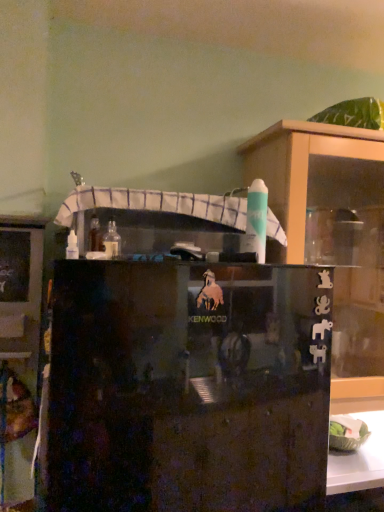
Question: Considering their positions, is black glossy cabinet at center, the 1th cabinetry positioned from the right, located in front of or behind clear glass bottle at center?

Choices:
 (A) front
 (B) behind

Answer: (A)

Question: From a real-world perspective, is black glossy cabinet at center, which is the 2th cabinetry from left to right, above or below clear glass bottle at center?

Choices:
 (A) below
 (B) above

Answer: (A)

Question: Which object is positioned farthest from the black glossy cabinet at center, which is the 2th cabinetry from left to right?

Choices:
 (A) transparent glass cupboard at upper right
 (B) white fabric at upper center
 (C) matte black cabinet at left, the 1th cabinetry viewed from the left
 (D) clear glass bottle at center

Answer: (C)

Question: Estimate the real-world distances between objects in this image. Which object is closer to the clear glass bottle at center?

Choices:
 (A) matte black cabinet at left, the 1th cabinetry viewed from the left
 (B) white fabric at upper center
 (C) transparent glass cupboard at upper right
 (D) black glossy cabinet at center, which is the 2th cabinetry from left to right

Answer: (B)